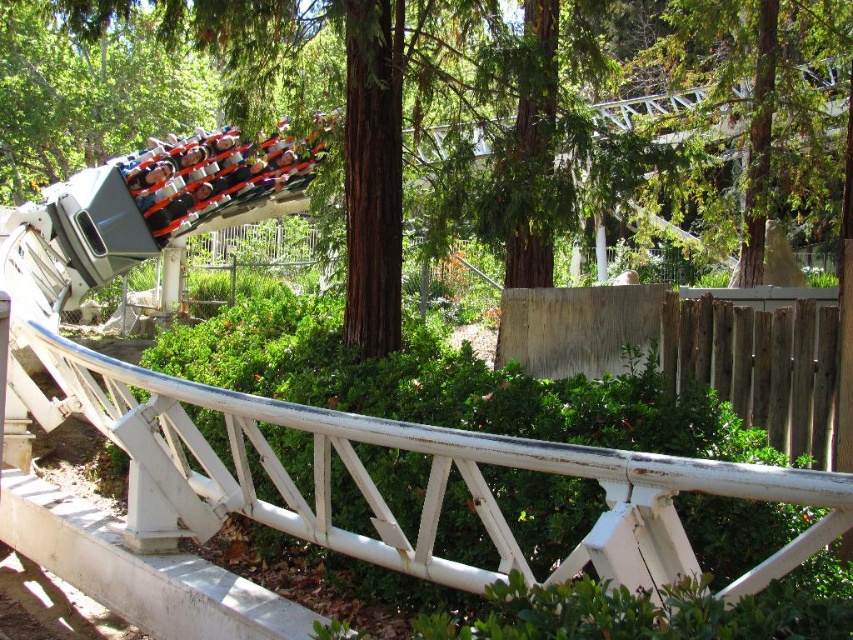
Question: Does white matte roller coaster rail at center appear on the right side of green textured tree at upper center?

Choices:
 (A) yes
 (B) no

Answer: (B)

Question: Is white matte roller coaster rail at center below green textured tree at upper center?

Choices:
 (A) no
 (B) yes

Answer: (B)

Question: Is white matte roller coaster rail at center below green textured tree at upper center?

Choices:
 (A) no
 (B) yes

Answer: (B)

Question: Which point is farther to the camera?

Choices:
 (A) green textured tree at upper center
 (B) matte black roller coaster at upper left

Answer: (A)

Question: Among these points, which one is farthest from the camera?

Choices:
 (A) (234, 145)
 (B) (782, 163)

Answer: (A)

Question: Which object appears closest to the camera in this image?

Choices:
 (A) green textured tree at upper center
 (B) matte black roller coaster at upper left

Answer: (B)